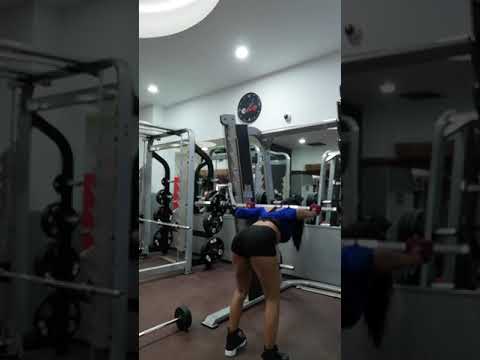
The width and height of the screenshot is (480, 360). In order to click on mirror in this screenshot , I will do `click(307, 161)`.